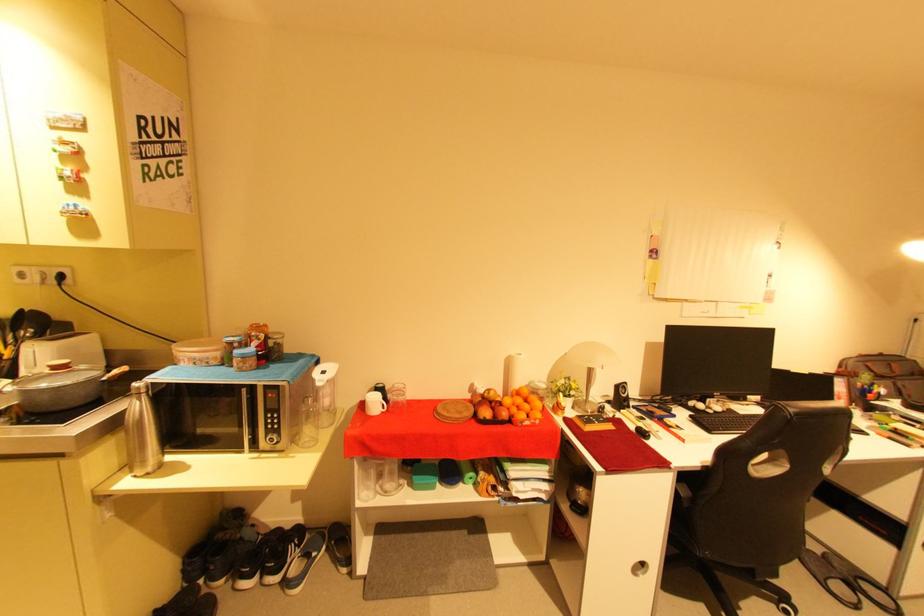
The image size is (924, 616). What do you see at coordinates (638, 568) in the screenshot?
I see `a circular drawer handle` at bounding box center [638, 568].